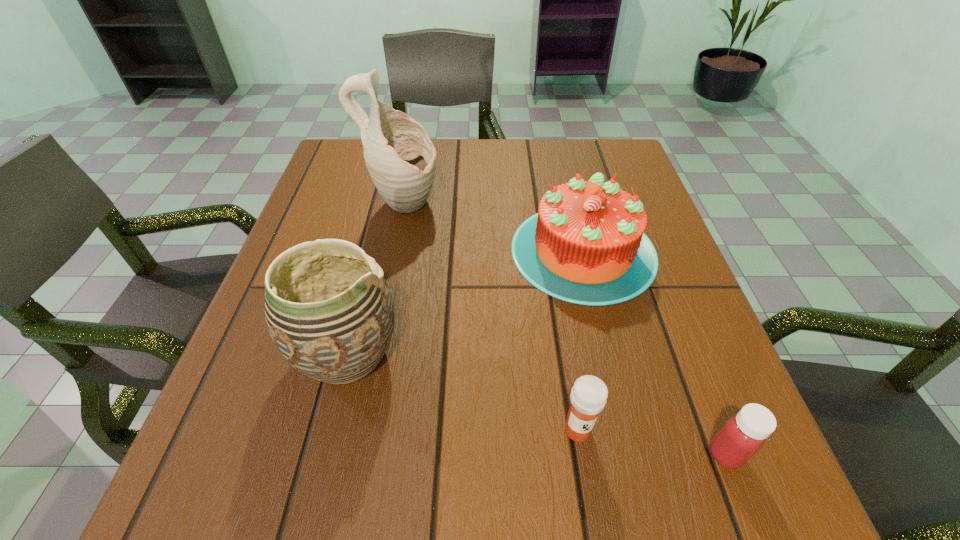
Find the location of a particular element. Image resolution: width=960 pixels, height=540 pixels. vacant region at the near edge of the desktop is located at coordinates (430, 471).

Where is `blank space at the left edge of the desktop`? blank space at the left edge of the desktop is located at coordinates (254, 365).

At what (x,y) coordinates should I click in order to perform the action: click on vacant space at the right edge. Please return your answer as a coordinate pair (x, y). Image resolution: width=960 pixels, height=540 pixels. Looking at the image, I should click on (663, 283).

Image resolution: width=960 pixels, height=540 pixels. Find the location of `vacant space at the far left corner of the desktop`. vacant space at the far left corner of the desktop is located at coordinates (327, 174).

At what (x,y) coordinates should I click in order to perform the action: click on vacant space at the near left corner. Please return your answer as a coordinate pair (x, y). The width and height of the screenshot is (960, 540). Looking at the image, I should click on (211, 489).

Find the location of a particular element. The image size is (960, 540). vacant space at the far right corner of the desktop is located at coordinates (595, 148).

Locate an element on the screen. This screenshot has height=540, width=960. free location at the near right corner of the desktop is located at coordinates (680, 521).

The image size is (960, 540). Identify the location of vacant space that is in between the left medicine and the third shortest object. (581, 340).

This screenshot has height=540, width=960. What are the coordinates of `vacant space that is in between the tallest object and the cake` in the screenshot? It's located at (493, 228).

At what (x,y) coordinates should I click in order to perform the action: click on free space between the right medicine and the tallest object. Please return your answer as a coordinate pair (x, y). The height and width of the screenshot is (540, 960). Looking at the image, I should click on (564, 330).